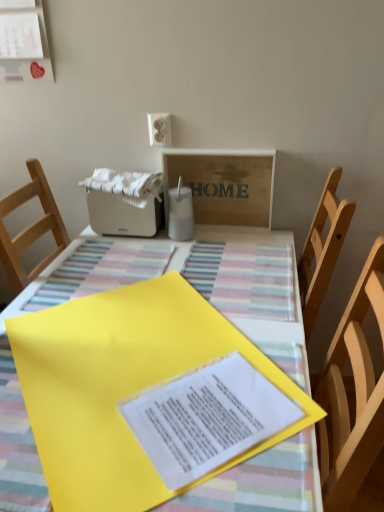
Locate an element on the screen. free space in front of wooden signboard at upper center is located at coordinates (221, 251).